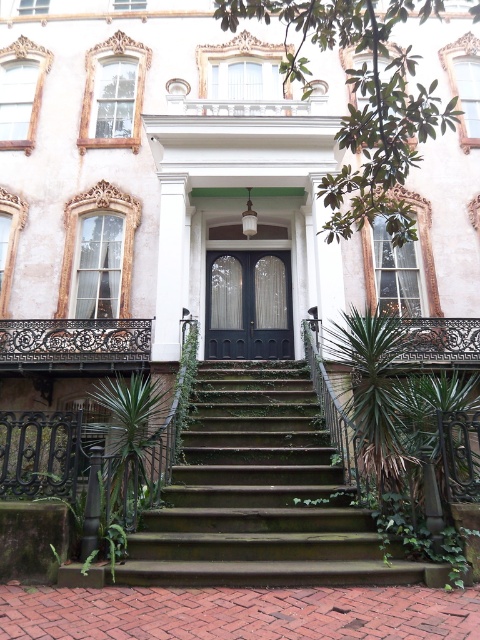
Question: Does green mossy stairs at center have a smaller size compared to green leafy plant at lower left?

Choices:
 (A) no
 (B) yes

Answer: (A)

Question: Which of the following is the closest to the observer?

Choices:
 (A) (144, 344)
 (B) (181, 396)
 (C) (213, 573)

Answer: (C)

Question: Can you confirm if green leafy plant at lower left is wider than black wrought iron balustrade at center?

Choices:
 (A) no
 (B) yes

Answer: (A)

Question: Which point is farther from the camera taking this photo?

Choices:
 (A) (178, 394)
 (B) (119, 365)
 (C) (192, 508)

Answer: (B)

Question: Does black matte door at center have a lesser width compared to green ivy at center?

Choices:
 (A) yes
 (B) no

Answer: (B)

Question: Considering the real-world distances, which object is closest to the green mossy stairs at center?

Choices:
 (A) green ivy at center
 (B) green leafy plant at center

Answer: (B)